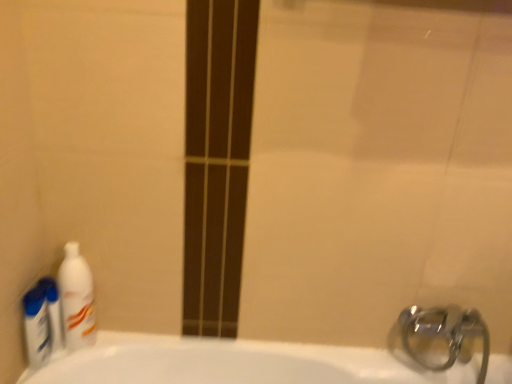
Question: Is white glossy mouthwash at left looking in the opposite direction of blue plastic bottles at left, which is the 2th cleaning product from right to left?

Choices:
 (A) no
 (B) yes

Answer: (B)

Question: From a real-world perspective, is white glossy mouthwash at left beneath blue plastic bottles at left, arranged as the 1th cleaning product when viewed from the left?

Choices:
 (A) yes
 (B) no

Answer: (B)

Question: Is white glossy mouthwash at left thinner than blue plastic bottles at left, which is the 2th cleaning product from right to left?

Choices:
 (A) no
 (B) yes

Answer: (B)

Question: From the image's perspective, is white glossy mouthwash at left located above blue plastic bottles at left, arranged as the 1th cleaning product when viewed from the left?

Choices:
 (A) no
 (B) yes

Answer: (B)

Question: Considering the relative sizes of white glossy mouthwash at left and blue plastic bottles at left, arranged as the 1th cleaning product when viewed from the left, in the image provided, is white glossy mouthwash at left smaller than blue plastic bottles at left, arranged as the 1th cleaning product when viewed from the left,?

Choices:
 (A) yes
 (B) no

Answer: (B)

Question: Is white glossy mouthwash at left completely or partially outside of blue plastic bottles at left, which is the 2th cleaning product from right to left?

Choices:
 (A) no
 (B) yes

Answer: (B)

Question: Is white glossy mouthwash at left taller than white glossy bottle at left, which is the 1th cleaning product in right-to-left order?

Choices:
 (A) yes
 (B) no

Answer: (B)

Question: From the image's perspective, is white glossy mouthwash at left above white glossy bottle at left, which is the 1th cleaning product in right-to-left order?

Choices:
 (A) no
 (B) yes

Answer: (A)

Question: Does white glossy mouthwash at left have a lesser height compared to white glossy bottle at left, which is the 1th cleaning product in right-to-left order?

Choices:
 (A) yes
 (B) no

Answer: (A)

Question: Does white glossy mouthwash at left have a larger size compared to white glossy bottle at left, which is the 1th cleaning product in right-to-left order?

Choices:
 (A) no
 (B) yes

Answer: (A)

Question: Are white glossy mouthwash at left and white glossy bottle at left, which is the 2th cleaning product from left to right, far apart?

Choices:
 (A) yes
 (B) no

Answer: (B)

Question: Is white glossy mouthwash at left located outside white glossy bottle at left, which is the 1th cleaning product in right-to-left order?

Choices:
 (A) yes
 (B) no

Answer: (A)

Question: Is white glossy bottle at left, which is the 2th cleaning product from left to right, not close to white glossy mouthwash at left?

Choices:
 (A) yes
 (B) no

Answer: (B)